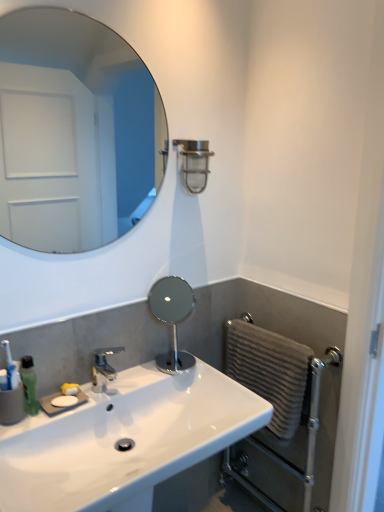
At what (x,y) coordinates should I click in order to perform the action: click on free space in front of polished silver mirror at center, acting as the 2th mirror starting from the top. Please return your answer as a coordinate pair (x, y). Looking at the image, I should click on (186, 377).